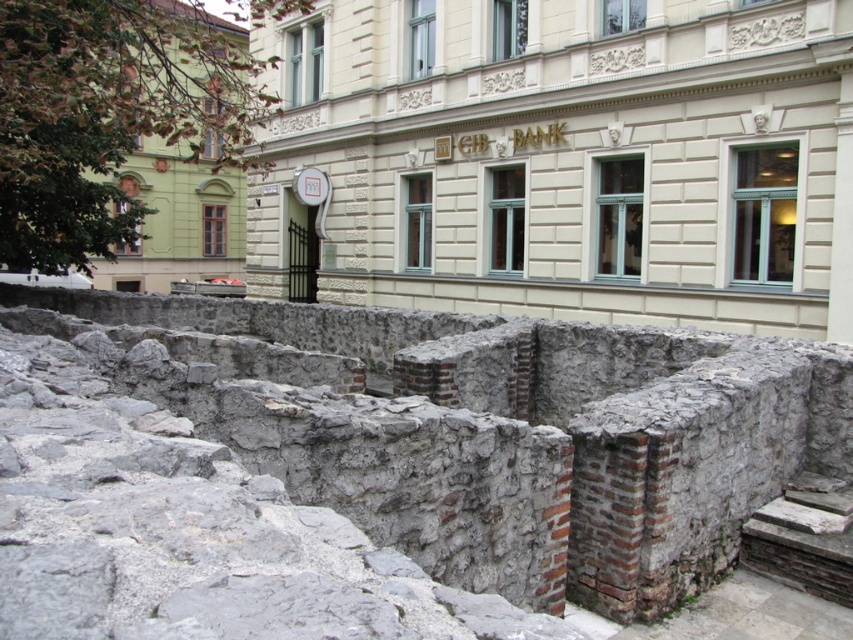
Can you confirm if stone wall ruins at center is positioned to the right of gray stone wall at center?

Correct, you'll find stone wall ruins at center to the right of gray stone wall at center.

Consider the image. Does stone wall ruins at center have a greater width compared to gray stone wall at center?

In fact, stone wall ruins at center might be narrower than gray stone wall at center.

Is point (585, 273) closer to viewer compared to point (770, 481)?

No.

I want to click on stone wall ruins at center, so click(563, 161).